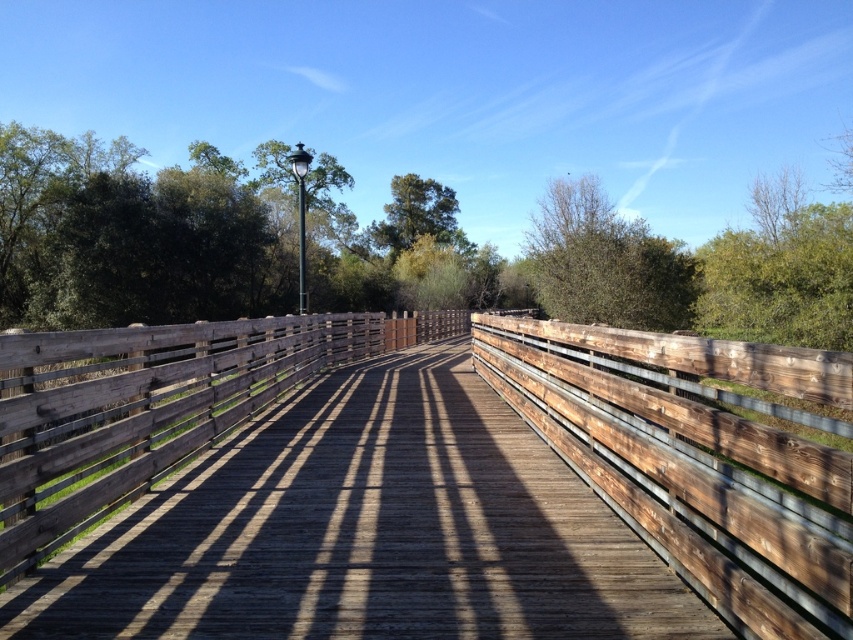
Question: Which point is closer to the camera taking this photo?

Choices:
 (A) (430, 227)
 (B) (683, 317)
 (C) (468, 364)

Answer: (C)

Question: Which point appears farthest from the camera in this image?

Choices:
 (A) (320, 492)
 (B) (425, 211)
 (C) (735, 252)

Answer: (B)

Question: Can you confirm if weathered wood bridge at center is positioned above green matte tree at center?

Choices:
 (A) yes
 (B) no

Answer: (B)

Question: In this image, where is weathered wood bridge at center located relative to green leafy tree at center?

Choices:
 (A) left
 (B) right

Answer: (A)

Question: Where is weathered wood bridge at center located in relation to green leafy tree at center in the image?

Choices:
 (A) left
 (B) right

Answer: (A)

Question: Based on their relative distances, which object is farther from the weathered wood bridge at center?

Choices:
 (A) green leafy tree at center
 (B) green matte tree at center

Answer: (B)